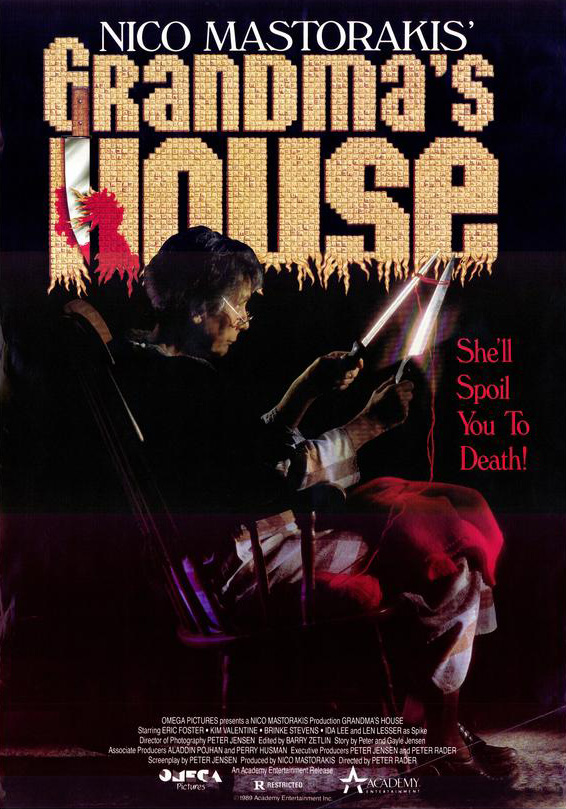
Where is `blanket`? The width and height of the screenshot is (566, 809). blanket is located at coordinates [x=456, y=518].